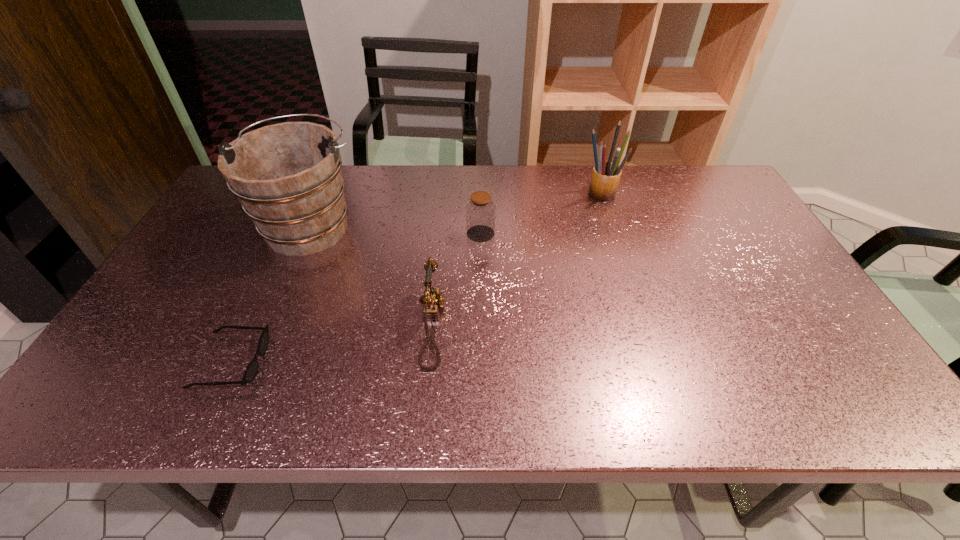
The width and height of the screenshot is (960, 540). Identify the location of free spot between the sunglasses and the telephone. (332, 344).

At what (x,y) coordinates should I click in order to perform the action: click on the second closest object to the bucket. Please return your answer as a coordinate pair (x, y). Looking at the image, I should click on (252, 368).

You are a GUI agent. You are given a task and a screenshot of the screen. Output one action in this format:
    pyautogui.click(x=<x>, y=<y>)
    Task: Click on the object that is the second closest one to the tallest object
    The image size is (960, 540).
    Given the screenshot: What is the action you would take?
    (x=252, y=368)

Locate an element on the screen. The image size is (960, 540). free space in the image that satisfies the following two spatial constraints: 1. on the front side of the pencil box; 2. on the front-facing side of the third object from left to right is located at coordinates (644, 326).